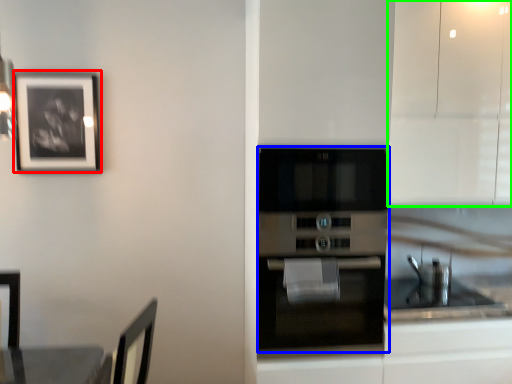
Question: Estimate the real-world distances between objects in this image. Which object is farther from picture frame (highlighted by a red box), oven (highlighted by a blue box) or cabinetry (highlighted by a green box)?

Choices:
 (A) oven
 (B) cabinetry

Answer: (B)